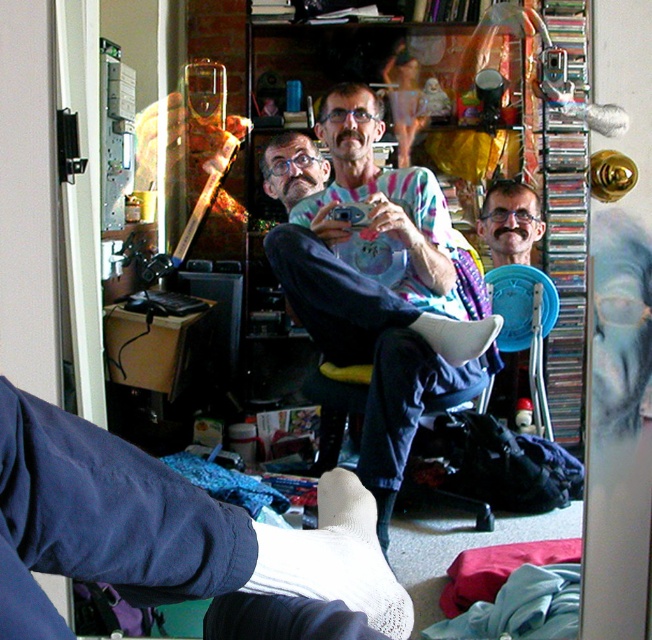
Question: Is white fabric chair at center to the left of blue plastic chair at center from the viewer's perspective?

Choices:
 (A) yes
 (B) no

Answer: (A)

Question: Which of the following is the farthest from the observer?

Choices:
 (A) blue plastic chair at center
 (B) white fabric chair at center
 (C) white knitted sock at lower center
 (D) matte black glasses at center

Answer: (D)

Question: Is matte tie-dye shirt at center to the left of matte black glasses at center from the viewer's perspective?

Choices:
 (A) no
 (B) yes

Answer: (A)

Question: Which object is the closest to the matte black glasses at center?

Choices:
 (A) white mesh sock at lower center
 (B) white knitted sock at center
 (C) white knitted sock at lower center

Answer: (B)

Question: Which object is closer to the camera taking this photo?

Choices:
 (A) matte black glasses at center
 (B) white knitted sock at center

Answer: (B)

Question: Can you confirm if white mesh sock at lower center is positioned below white knitted sock at center?

Choices:
 (A) yes
 (B) no

Answer: (A)